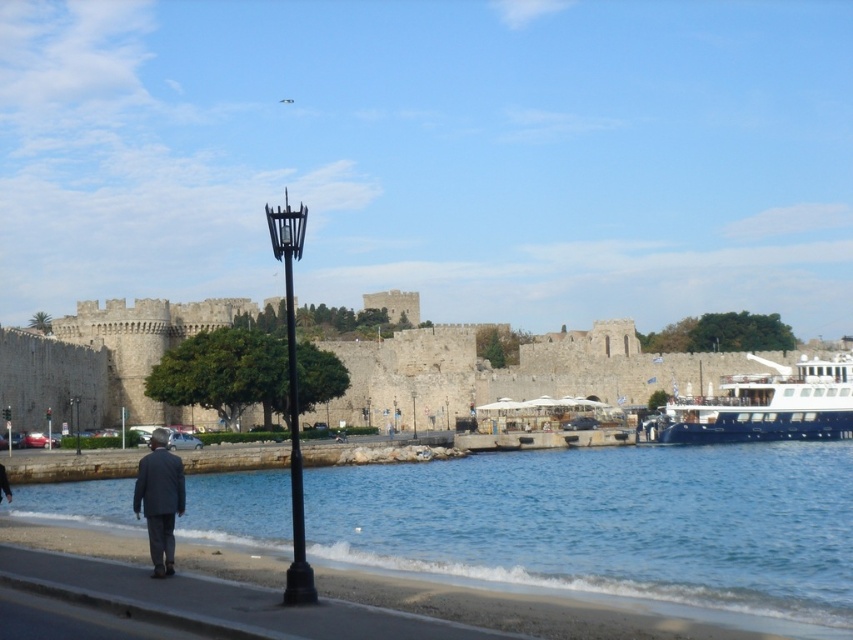
From the picture: Is black metal streetlight at center to the right of black metal lamp post at lower center from the viewer's perspective?

Correct, you'll find black metal streetlight at center to the right of black metal lamp post at lower center.

Locate an element on the screen. The height and width of the screenshot is (640, 853). black metal streetlight at center is located at coordinates (292, 396).

This screenshot has height=640, width=853. I want to click on black metal streetlight at center, so 292,396.

You are a GUI agent. You are given a task and a screenshot of the screen. Output one action in this format:
    pyautogui.click(x=<x>, y=<y>)
    Task: Click on the blue glossy yacht at right
    The width and height of the screenshot is (853, 640).
    Given the screenshot: What is the action you would take?
    pyautogui.click(x=762, y=406)

Describe the element at coordinates (762, 406) in the screenshot. I see `blue glossy yacht at right` at that location.

Between point (682, 403) and point (282, 598), which one is positioned behind?

Positioned behind is point (682, 403).

Identify the location of blue glossy yacht at right. The width and height of the screenshot is (853, 640). (762, 406).

Does blue glossy yacht at right have a lesser width compared to black metal lamp post at lower center?

In fact, blue glossy yacht at right might be wider than black metal lamp post at lower center.

The height and width of the screenshot is (640, 853). What do you see at coordinates (762, 406) in the screenshot? I see `blue glossy yacht at right` at bounding box center [762, 406].

Is point (848, 372) positioned in front of point (73, 422)?

No.

Find the location of a particular element. blue glossy yacht at right is located at coordinates (762, 406).